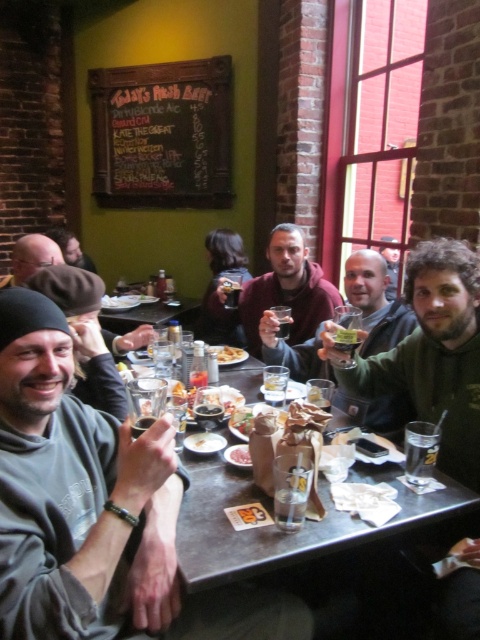
You are a customer at the bar and want to place your phone on the table without it tipping over. The matte brown hoodie at center and golden crispy fries at center are on the table. Which object should you place your phone next to for stability?

The matte brown hoodie at center is larger in size than golden crispy fries at center, so placing the phone next to the matte brown hoodie at center would provide a more stable surface.